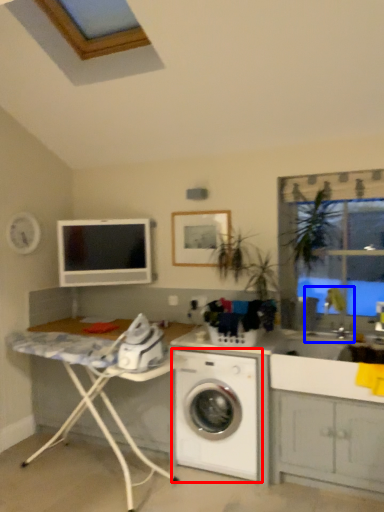
Question: Among these objects, which one is nearest to the camera, washing machine (highlighted by a red box) or sink (highlighted by a blue box)?

Choices:
 (A) washing machine
 (B) sink

Answer: (A)